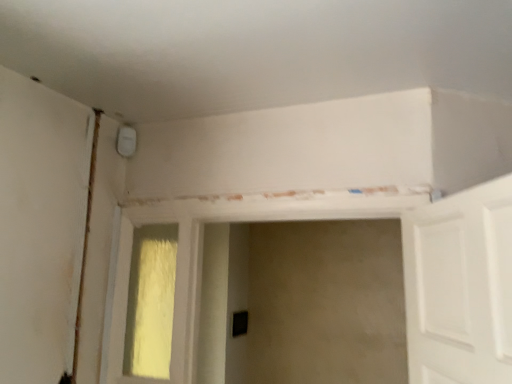
The height and width of the screenshot is (384, 512). What do you see at coordinates (175, 289) in the screenshot?
I see `white painted wood window frame at center` at bounding box center [175, 289].

Image resolution: width=512 pixels, height=384 pixels. Identify the location of white painted wood window frame at center. (175, 289).

Locate an element on the screen. The image size is (512, 384). white painted wood window frame at center is located at coordinates (175, 289).